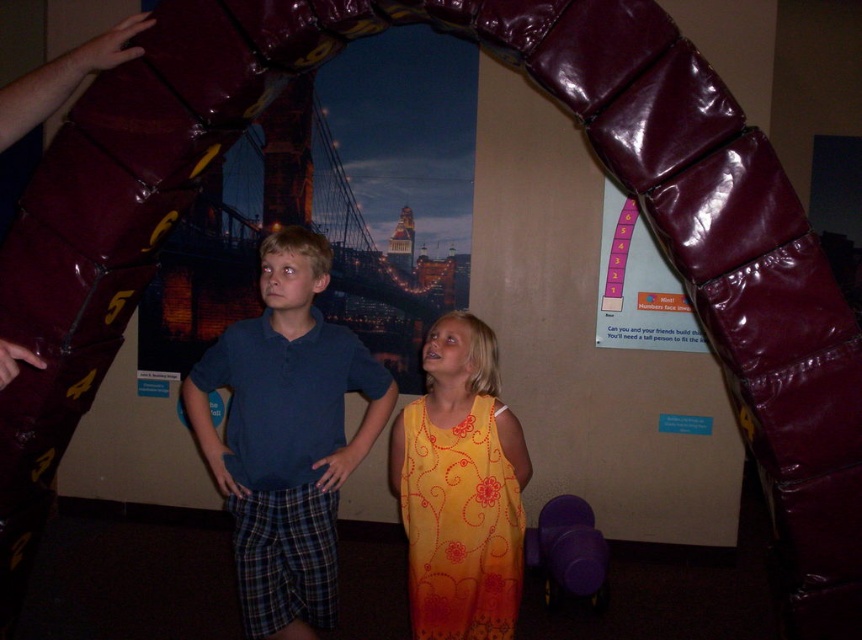
Question: Observing the image, what is the correct spatial positioning of blue cotton shirt at center in reference to matte blue polo shirt at center?

Choices:
 (A) above
 (B) below

Answer: (B)

Question: Can you confirm if blue cotton shirt at center is positioned above maroon leather armrest at upper left?

Choices:
 (A) yes
 (B) no

Answer: (B)

Question: Which point is closer to the camera?

Choices:
 (A) (280, 380)
 (B) (66, 54)

Answer: (B)

Question: Which object is farther from the camera taking this photo?

Choices:
 (A) yellow floral dress at center
 (B) blue cotton shirt at center

Answer: (B)

Question: Is blue cotton shirt at center in front of matte blue polo shirt at center?

Choices:
 (A) no
 (B) yes

Answer: (B)

Question: Which object is farther from the camera taking this photo?

Choices:
 (A) blue cotton shirt at center
 (B) matte blue polo shirt at center
 (C) yellow floral dress at center
 (D) maroon leather armrest at upper left

Answer: (B)